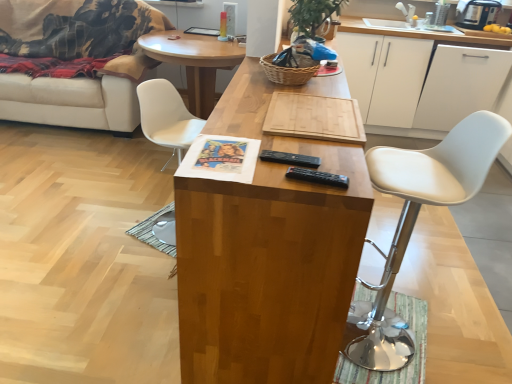
Question: Could woven brown basket at center be considered to be inside wooden cutting board at center, positioned as the second coffee table in back-to-front order?

Choices:
 (A) no
 (B) yes

Answer: (A)

Question: Does wooden cutting board at center, which is the 1th coffee table in front-to-back order, come behind woven brown basket at center?

Choices:
 (A) yes
 (B) no

Answer: (B)

Question: Could you tell me if wooden cutting board at center, which is the 1th coffee table in front-to-back order, is facing woven brown basket at center?

Choices:
 (A) yes
 (B) no

Answer: (B)

Question: Is wooden cutting board at center, which is the 1th coffee table in front-to-back order, looking in the opposite direction of woven brown basket at center?

Choices:
 (A) yes
 (B) no

Answer: (B)

Question: From a real-world perspective, is wooden cutting board at center, positioned as the second coffee table in back-to-front order, on top of woven brown basket at center?

Choices:
 (A) yes
 (B) no

Answer: (B)

Question: From the image's perspective, is wooden cutting board at center, acting as the first coffee table starting from the back, above or below woven brown basket at center?

Choices:
 (A) below
 (B) above

Answer: (B)

Question: Does point (153, 39) appear closer or farther from the camera than point (286, 81)?

Choices:
 (A) farther
 (B) closer

Answer: (A)

Question: Visually, is wooden cutting board at center, which appears as the 2th coffee table when viewed from the front, positioned to the left or to the right of woven brown basket at center?

Choices:
 (A) right
 (B) left

Answer: (B)

Question: From a real-world perspective, is wooden cutting board at center, acting as the first coffee table starting from the back, above or below woven brown basket at center?

Choices:
 (A) above
 (B) below

Answer: (B)

Question: In the image, is white leather stool at right, the 2th chair in the back-to-front sequence, positioned in front of or behind wooden cutting board at center, which appears as the 2th coffee table when viewed from the front?

Choices:
 (A) front
 (B) behind

Answer: (A)

Question: Is white leather stool at right, which appears as the first chair when viewed from the right, inside or outside of wooden cutting board at center, which appears as the 2th coffee table when viewed from the front?

Choices:
 (A) outside
 (B) inside

Answer: (A)

Question: From the image's perspective, is white leather stool at right, the first chair from the front, located above or below wooden cutting board at center, which appears as the 2th coffee table when viewed from the front?

Choices:
 (A) below
 (B) above

Answer: (A)

Question: Does point (464, 183) appear closer or farther from the camera than point (148, 56)?

Choices:
 (A) closer
 (B) farther

Answer: (A)

Question: From their relative heights in the image, would you say white leather stool at right, the first chair from the front, is taller or shorter than white matte cabinet at upper right, which appears as the second cabinetry when viewed from the left?

Choices:
 (A) short
 (B) tall

Answer: (B)

Question: Considering the positions of point (407, 205) and point (458, 64), is point (407, 205) closer or farther from the camera than point (458, 64)?

Choices:
 (A) farther
 (B) closer

Answer: (B)